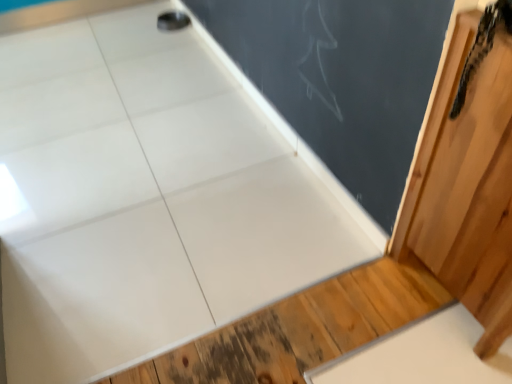
Question: Does matte black chalkboard at upper center turn towards black textured snake at upper right?

Choices:
 (A) no
 (B) yes

Answer: (A)

Question: From a real-world perspective, is matte black chalkboard at upper center over black textured snake at upper right?

Choices:
 (A) no
 (B) yes

Answer: (A)

Question: Does matte black chalkboard at upper center appear on the right side of black textured snake at upper right?

Choices:
 (A) no
 (B) yes

Answer: (A)

Question: From a real-world perspective, is matte black chalkboard at upper center below black textured snake at upper right?

Choices:
 (A) no
 (B) yes

Answer: (B)

Question: Can you see matte black chalkboard at upper center touching black textured snake at upper right?

Choices:
 (A) no
 (B) yes

Answer: (A)

Question: Is matte black chalkboard at upper center bigger or smaller than black textured snake at upper right?

Choices:
 (A) small
 (B) big

Answer: (A)

Question: Is matte black chalkboard at upper center spatially inside black textured snake at upper right, or outside of it?

Choices:
 (A) inside
 (B) outside

Answer: (B)

Question: From a real-world perspective, is matte black chalkboard at upper center positioned above or below black textured snake at upper right?

Choices:
 (A) above
 (B) below

Answer: (B)

Question: In terms of height, does matte black chalkboard at upper center look taller or shorter compared to black textured snake at upper right?

Choices:
 (A) tall
 (B) short

Answer: (B)

Question: In terms of height, does black textured snake at upper right look taller or shorter compared to matte black chalkboard at upper center?

Choices:
 (A) tall
 (B) short

Answer: (A)

Question: Is black textured snake at upper right to the left or to the right of matte black chalkboard at upper center in the image?

Choices:
 (A) left
 (B) right

Answer: (B)

Question: Considering the positions of black textured snake at upper right and matte black chalkboard at upper center in the image, is black textured snake at upper right bigger or smaller than matte black chalkboard at upper center?

Choices:
 (A) small
 (B) big

Answer: (B)

Question: Is black textured snake at upper right in front of or behind matte black chalkboard at upper center in the image?

Choices:
 (A) behind
 (B) front

Answer: (B)

Question: Based on their sizes in the image, would you say black textured snake at upper right is bigger or smaller than wooden barn door at right?

Choices:
 (A) small
 (B) big

Answer: (A)

Question: Does point (475, 44) appear closer or farther from the camera than point (483, 279)?

Choices:
 (A) closer
 (B) farther

Answer: (A)